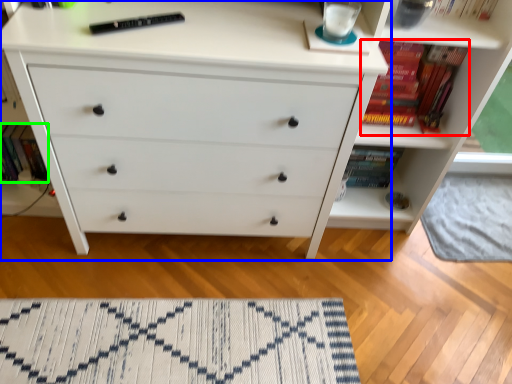
Question: Which object is positioned closest to book (highlighted by a red box)? Select from chest of drawers (highlighted by a blue box) and book (highlighted by a green box).

Choices:
 (A) chest of drawers
 (B) book

Answer: (A)